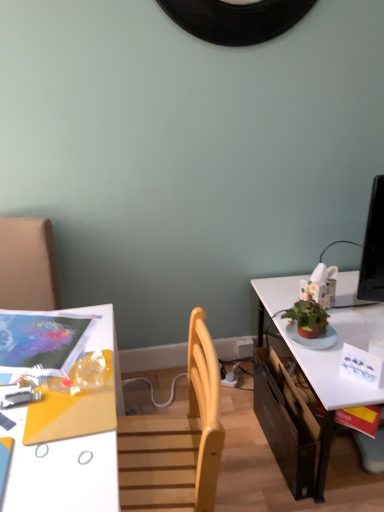
At what (x,y) coordinates should I click in order to perform the action: click on free space above white glossy desk at lower left (from a real-world perspective). Please return your answer as a coordinate pair (x, y). This screenshot has height=512, width=384. Looking at the image, I should click on (49, 383).